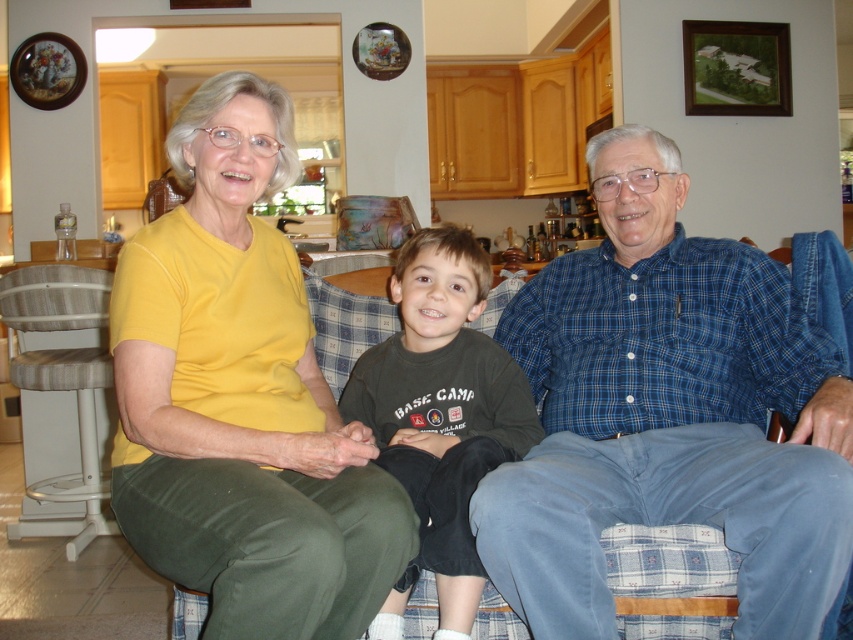
You are designing a layout for a photo album page and want to place the image in the center. You have two elements to add around it. The yellow matte shirt at upper left and the wooden textured stool at left. Since you want the larger element to be more prominent, which one should you place in a bigger frame?

The wooden textured stool at left should be placed in a bigger frame because the yellow matte shirt at upper left occupies less space than the wooden textured stool at left, indicating the stool is larger.

You are standing in front of the family on the plaid couch and want to move closer to both point (572, 403) and point (136, 285). Which point will require you to take fewer steps forward to reach?

Point (136, 285) will require fewer steps because it is closer to you than point (572, 403), which is further away.

You are arranging a family photo shoot and need to place a small decorative pillow between the dark gray cotton shirt at center and the wooden textured stool at left. Based on their positions, where should you place the pillow?

The dark gray cotton shirt at center is to the right of the wooden textured stool at left, so the pillow should be placed between them, to the right of the wooden textured stool at left and to the left of the dark gray cotton shirt at center.